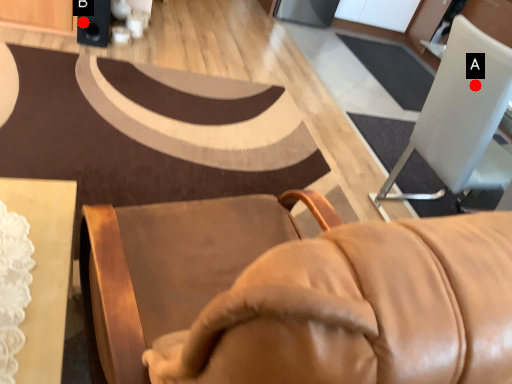
Question: Two points are circled on the image, labeled by A and B beside each circle. Which point is closer to the camera?

Choices:
 (A) A is closer
 (B) B is closer

Answer: (A)